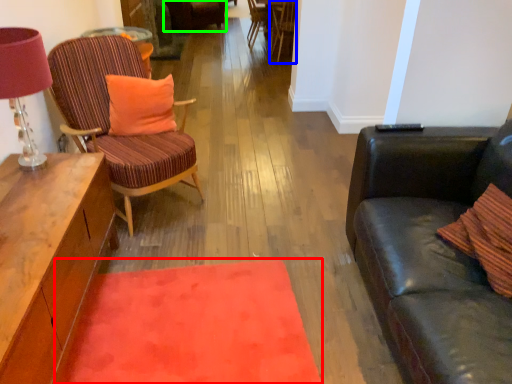
Question: Which object is positioned farthest from mat (highlighted by a red box)? Select from chair (highlighted by a blue box) and chair (highlighted by a green box).

Choices:
 (A) chair
 (B) chair

Answer: (B)